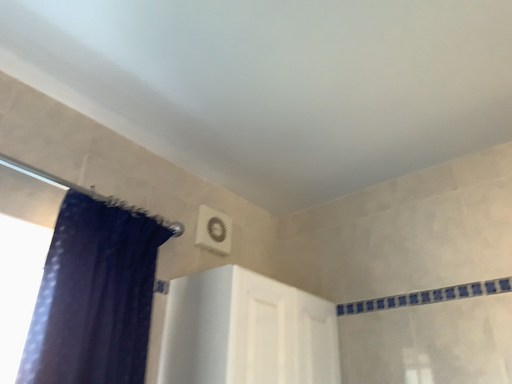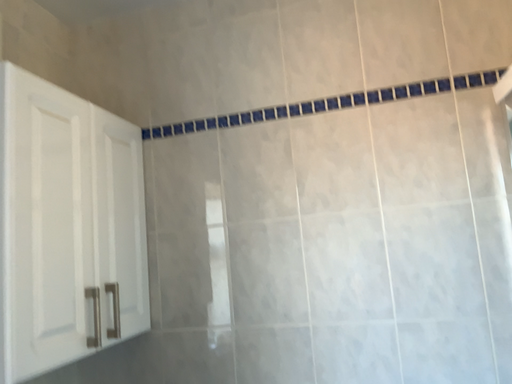
Question: Which way did the camera rotate in the video?

Choices:
 (A) rotated upward
 (B) rotated downward

Answer: (B)